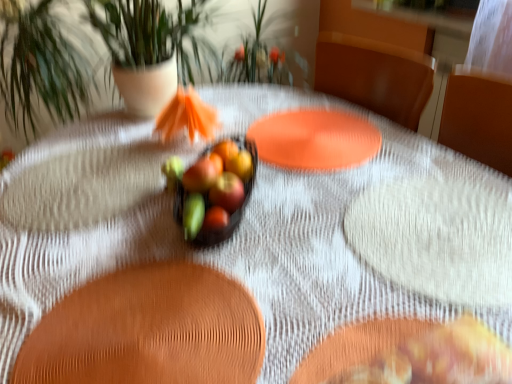
In order to click on vacant space that is to the left of green matte flower at center in this screenshot , I will do `click(122, 209)`.